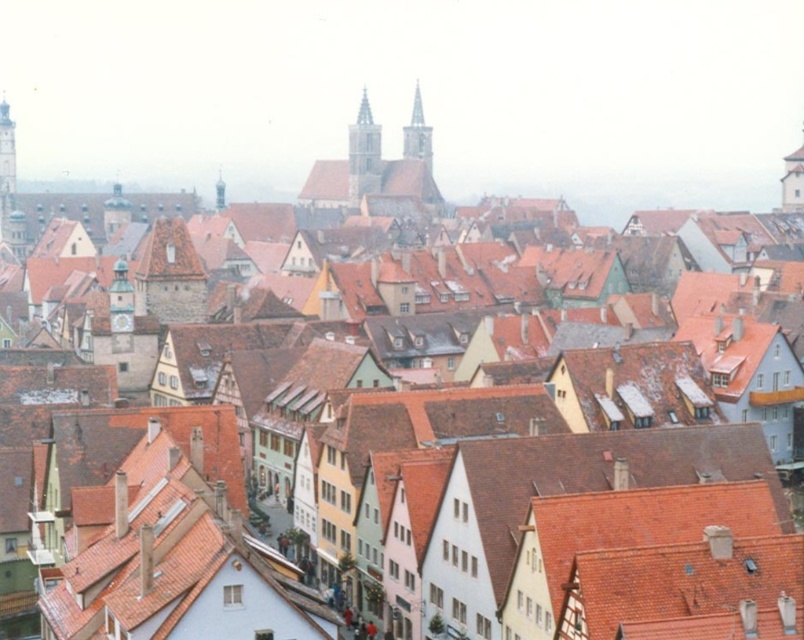
You are an architect analyzing the town layout. You notice the smooth stone tower at center and the smooth gray steeple at center. Which one is located higher in the image?

The smooth gray steeple at center is higher because the smooth stone tower at center is positioned under it.

You are a tourist standing in the historic town square and want to take a photo of both smooth stone tower at center and smooth stone tower at left. To include both in the frame, should you position yourself to the left or right of the towers?

To include both the smooth stone tower at center and the smooth stone tower at left in the frame, you should position yourself to the left of the towers. This way, the smooth stone tower at left will be on your right side and the smooth stone tower at center will be further to the right, allowing both to fit within the camera frame.